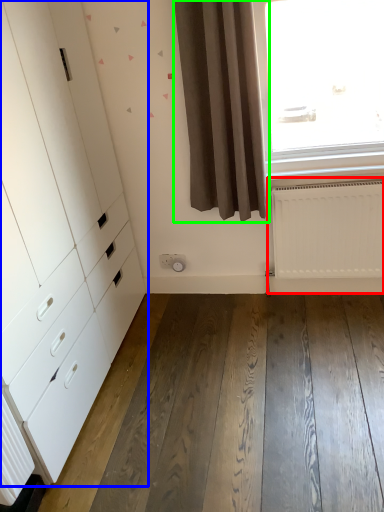
Question: Which object is the closest to the radiator (highlighted by a red box)? Choose among these: chest of drawers (highlighted by a blue box) or curtain (highlighted by a green box).

Choices:
 (A) chest of drawers
 (B) curtain

Answer: (B)